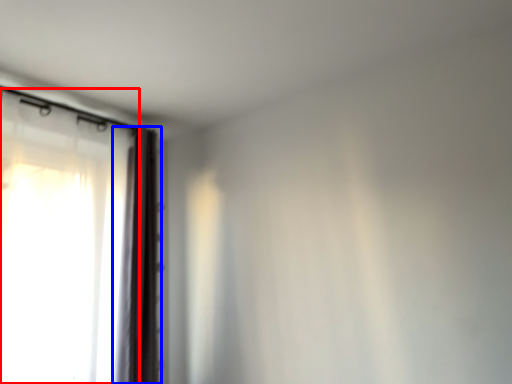
Question: Which of the following is the closest to the observer, curtain (highlighted by a red box) or curtain (highlighted by a blue box)?

Choices:
 (A) curtain
 (B) curtain

Answer: (A)